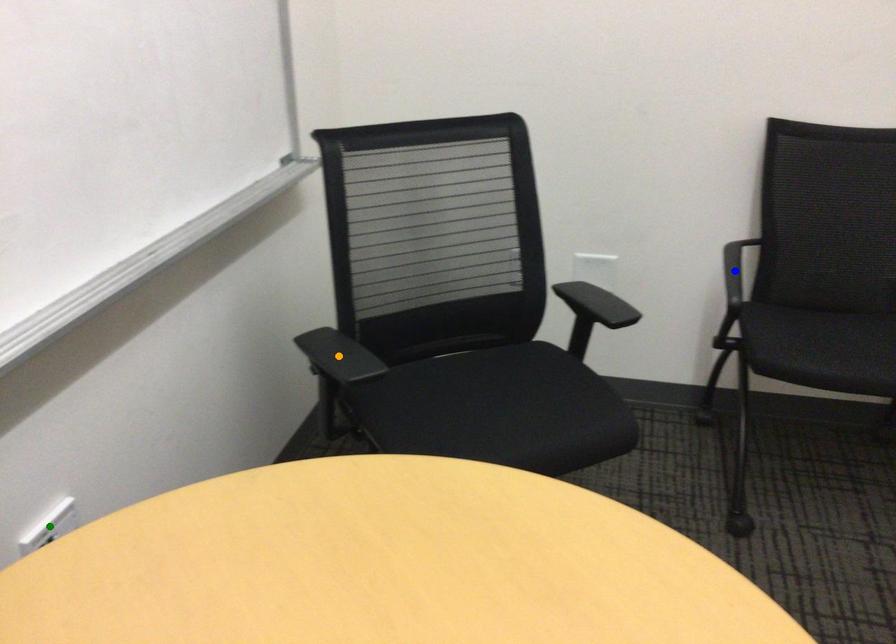
Order these from nearest to farthest:
blue point
green point
orange point

green point
orange point
blue point